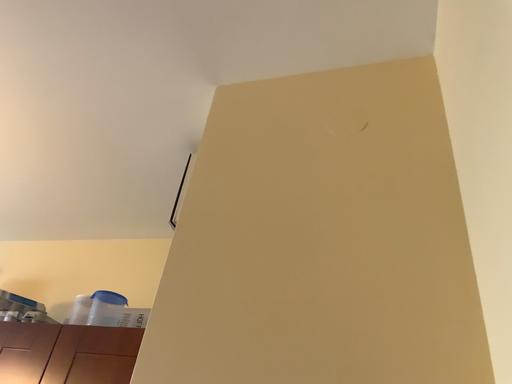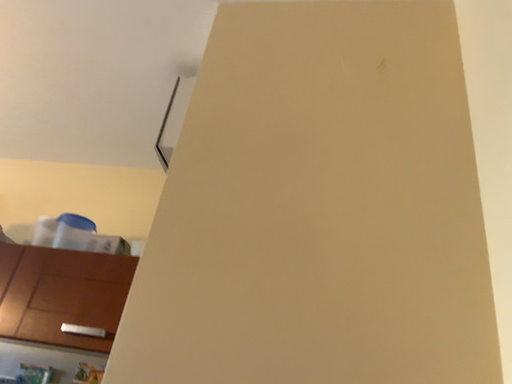
Question: Which way did the camera rotate in the video?

Choices:
 (A) rotated upward
 (B) rotated downward

Answer: (B)